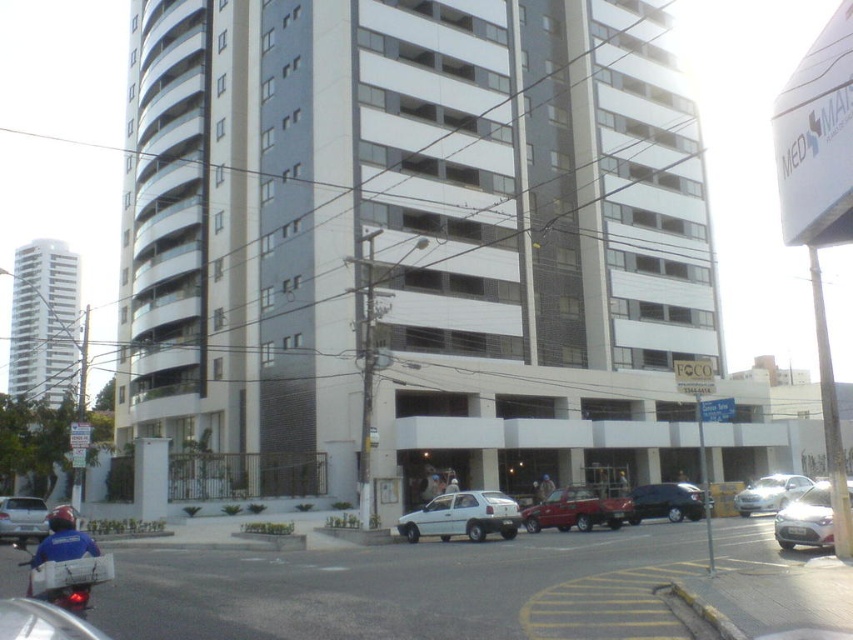
Question: Does metallic silver motorcycle at lower left appear over metallic red pickup truck at center?

Choices:
 (A) yes
 (B) no

Answer: (A)

Question: Which point is farther to the camera?

Choices:
 (A) (22, 509)
 (B) (627, 515)
 (C) (804, 477)

Answer: (C)

Question: Is metallic silver motorcycle at lower left bigger than silver metallic sedan at lower left?

Choices:
 (A) yes
 (B) no

Answer: (A)

Question: Which of the following is the farthest from the observer?

Choices:
 (A) white matte hatchback at center
 (B) metallic silver motorcycle at lower left

Answer: (A)

Question: Based on their relative distances, which object is farther from the satin silver sedan at lower right?

Choices:
 (A) shiny black sedan at center
 (B) metallic red pickup truck at center
 (C) silver metallic sedan at center
 (D) silver metallic sedan at lower left

Answer: (D)

Question: Is metallic red pickup truck at center in front of silver metallic sedan at center?

Choices:
 (A) yes
 (B) no

Answer: (A)